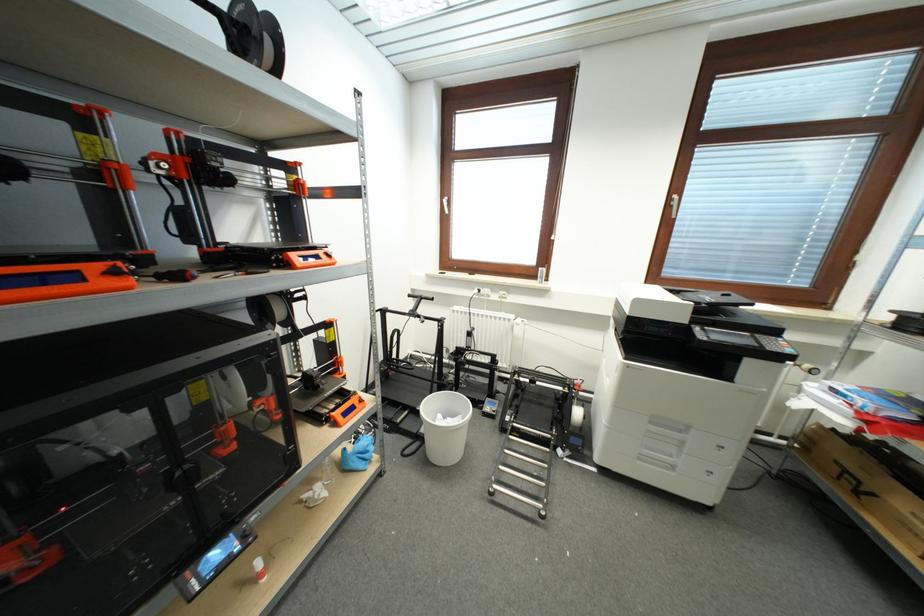
Which object does [250,34] point to?

It corresponds to the black filament spool in the image.